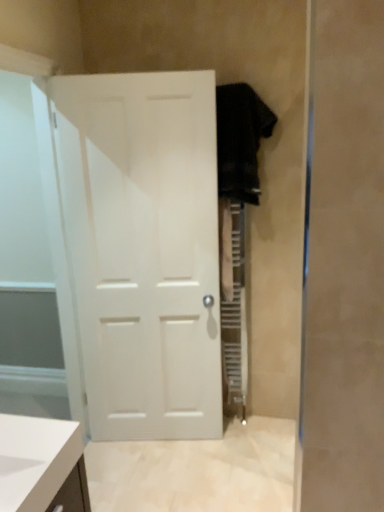
Question: From a real-world perspective, is transparent glass door at left positioned over white matte door at center based on gravity?

Choices:
 (A) yes
 (B) no

Answer: (A)

Question: Does transparent glass door at left have a lesser height compared to white matte door at center?

Choices:
 (A) yes
 (B) no

Answer: (B)

Question: Does transparent glass door at left lie behind white matte door at center?

Choices:
 (A) no
 (B) yes

Answer: (A)

Question: Is transparent glass door at left bigger than white matte door at center?

Choices:
 (A) yes
 (B) no

Answer: (A)

Question: Is transparent glass door at left aimed at white matte door at center?

Choices:
 (A) no
 (B) yes

Answer: (B)

Question: From the image's perspective, is white matte door at center located above or below transparent glass door at left?

Choices:
 (A) below
 (B) above

Answer: (B)

Question: Do you think white matte door at center is within transparent glass door at left, or outside of it?

Choices:
 (A) inside
 (B) outside

Answer: (B)

Question: Would you say white matte door at center is to the left or to the right of transparent glass door at left in the picture?

Choices:
 (A) right
 (B) left

Answer: (A)

Question: In terms of height, does white matte door at center look taller or shorter compared to transparent glass door at left?

Choices:
 (A) tall
 (B) short

Answer: (B)

Question: Considering the positions of point [130, 159] and point [253, 113], is point [130, 159] closer or farther from the camera than point [253, 113]?

Choices:
 (A) farther
 (B) closer

Answer: (B)

Question: Considering the positions of white matte door at center and black fabric robe at right in the image, is white matte door at center wider or thinner than black fabric robe at right?

Choices:
 (A) thin
 (B) wide

Answer: (A)

Question: In terms of height, does white matte door at center look taller or shorter compared to black fabric robe at right?

Choices:
 (A) tall
 (B) short

Answer: (A)

Question: Considering the relative positions of white matte door at center and black fabric robe at right in the image provided, is white matte door at center to the left or to the right of black fabric robe at right?

Choices:
 (A) left
 (B) right

Answer: (A)

Question: In the image, is transparent glass door at left positioned in front of or behind black fabric robe at right?

Choices:
 (A) behind
 (B) front

Answer: (B)

Question: Is transparent glass door at left wider or thinner than black fabric robe at right?

Choices:
 (A) wide
 (B) thin

Answer: (B)